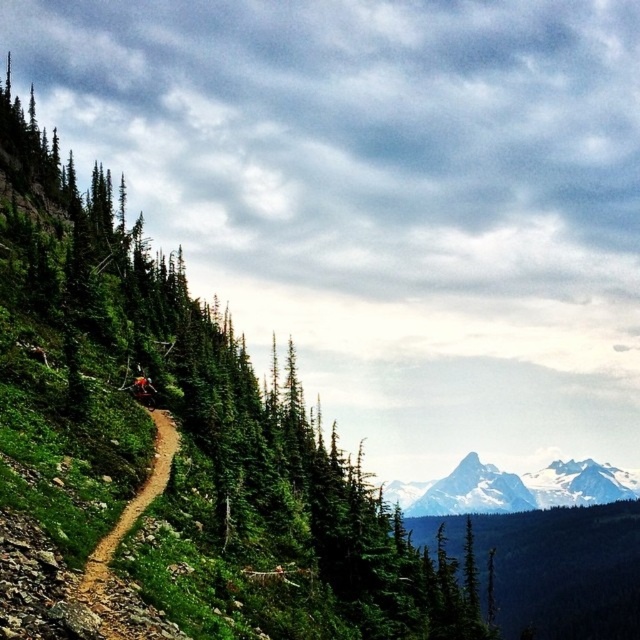
You are standing on the mountain trail and want to reach the point marked as point (618,499). There is also a point marked as point (396,550) along the way. Which point should you pass first?

You should pass point (396,550) first because it is closer to you than point (618,499).